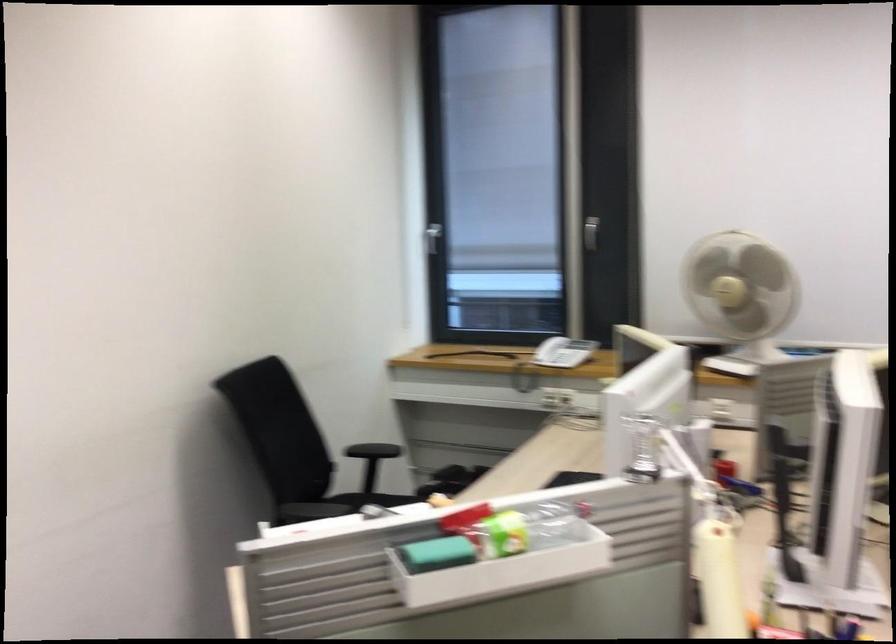
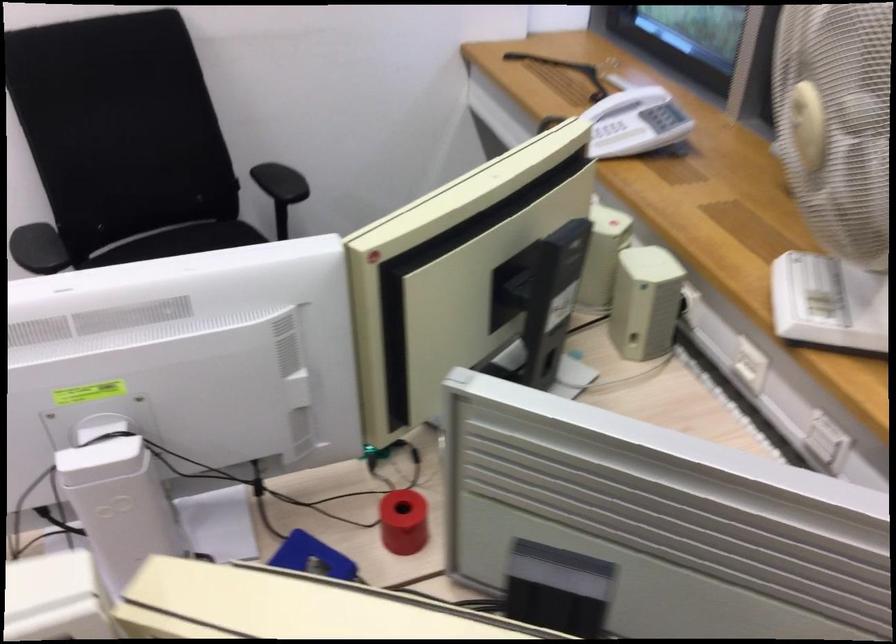
Question: I am providing you with two images of the same scene from different viewpoints. After the viewpoint changes to image2, which objects are now occluded?

Choices:
 (A) beige computer speaker
 (B) fan control buttons
 (C) chair sitting surface
 (D) none of these

Answer: (D)